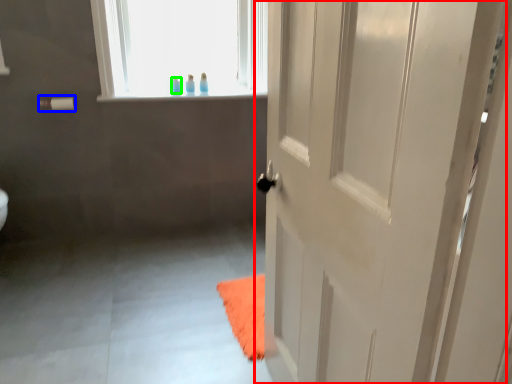
Question: Estimate the real-world distances between objects in this image. Which object is closer to door (highlighted by a red box), towel bar (highlighted by a blue box) or toiletry (highlighted by a green box)?

Choices:
 (A) towel bar
 (B) toiletry

Answer: (B)